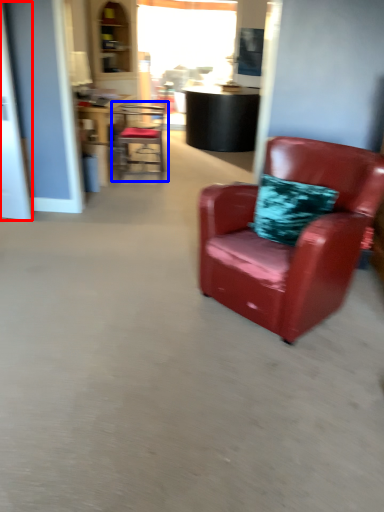
Question: Which object appears farthest to the camera in this image, glass door (highlighted by a red box) or chair (highlighted by a blue box)?

Choices:
 (A) glass door
 (B) chair

Answer: (B)